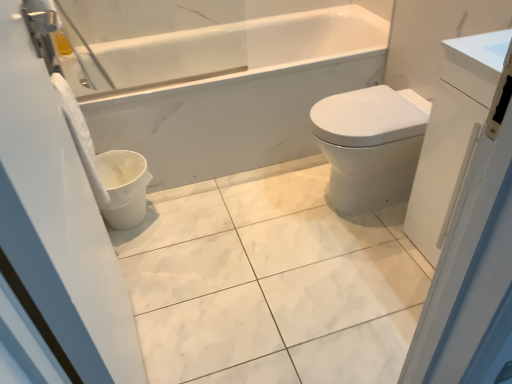
Question: Considering the relative sizes of white glossy bidet at right and white marble tile at center in the image provided, is white glossy bidet at right thinner than white marble tile at center?

Choices:
 (A) yes
 (B) no

Answer: (A)

Question: Can you confirm if white glossy bidet at right is wider than white marble tile at center?

Choices:
 (A) no
 (B) yes

Answer: (A)

Question: From a real-world perspective, is white glossy bidet at right on top of white marble tile at center?

Choices:
 (A) no
 (B) yes

Answer: (B)

Question: Does white glossy bidet at right touch white marble tile at center?

Choices:
 (A) yes
 (B) no

Answer: (B)

Question: From a real-world perspective, is white glossy bidet at right under white marble tile at center?

Choices:
 (A) no
 (B) yes

Answer: (A)

Question: In the image, is white glossy bidet at right positioned in front of or behind white marble tile at center?

Choices:
 (A) front
 (B) behind

Answer: (B)

Question: In terms of size, does white glossy bidet at right appear bigger or smaller than white marble tile at center?

Choices:
 (A) small
 (B) big

Answer: (B)

Question: From the image's perspective, is white glossy bidet at right located above or below white marble tile at center?

Choices:
 (A) above
 (B) below

Answer: (A)

Question: Considering the relative positions of white glossy bidet at right and white marble tile at center in the image provided, is white glossy bidet at right to the left or to the right of white marble tile at center?

Choices:
 (A) right
 (B) left

Answer: (A)

Question: Which is correct: white marble tile at center is inside white glossy cabinet at right, the 1th screen door positioned from the right, or outside of it?

Choices:
 (A) inside
 (B) outside

Answer: (B)

Question: Considering the positions of white marble tile at center and white glossy cabinet at right, the 1th screen door positioned from the right, in the image, is white marble tile at center taller or shorter than white glossy cabinet at right, the 1th screen door positioned from the right,?

Choices:
 (A) tall
 (B) short

Answer: (B)

Question: Considering their positions, is white marble tile at center located in front of or behind white glossy cabinet at right, the 1th screen door positioned from the right?

Choices:
 (A) front
 (B) behind

Answer: (B)

Question: Considering the relative positions of white marble tile at center and white glossy cabinet at right, the 1th screen door positioned from the right, in the image provided, is white marble tile at center to the left or to the right of white glossy cabinet at right, the 1th screen door positioned from the right,?

Choices:
 (A) right
 (B) left

Answer: (B)

Question: Considering the positions of white glossy screen door at left, placed as the second screen door when sorted from right to left, and white matte toilet paper at left in the image, is white glossy screen door at left, placed as the second screen door when sorted from right to left, bigger or smaller than white matte toilet paper at left?

Choices:
 (A) small
 (B) big

Answer: (B)

Question: Visually, is white glossy screen door at left, placed as the second screen door when sorted from right to left, positioned to the left or to the right of white matte toilet paper at left?

Choices:
 (A) left
 (B) right

Answer: (B)